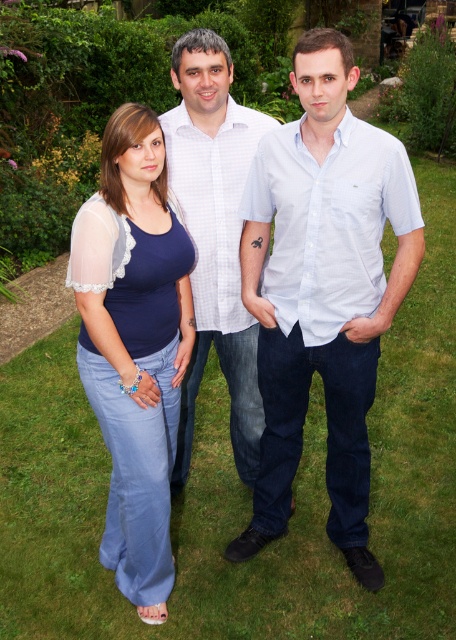
Question: Among these points, which one is farthest from the camera?

Choices:
 (A) coord(207,148)
 (B) coord(366,472)

Answer: (A)

Question: Is blue denim jeans at center thinner than white checkered shirt at center?

Choices:
 (A) yes
 (B) no

Answer: (A)

Question: Does light blue cotton shirt at center have a smaller size compared to white checkered shirt at center?

Choices:
 (A) yes
 (B) no

Answer: (B)

Question: Is blue denim jeans at center further to camera compared to white checkered shirt at center?

Choices:
 (A) no
 (B) yes

Answer: (A)

Question: Based on their relative distances, which object is farther from the blue denim jeans at center?

Choices:
 (A) white checkered shirt at center
 (B) light blue cotton shirt at center

Answer: (B)

Question: Which point is closer to the camera taking this photo?

Choices:
 (A) (124, 451)
 (B) (249, 401)
 (C) (373, 212)

Answer: (A)